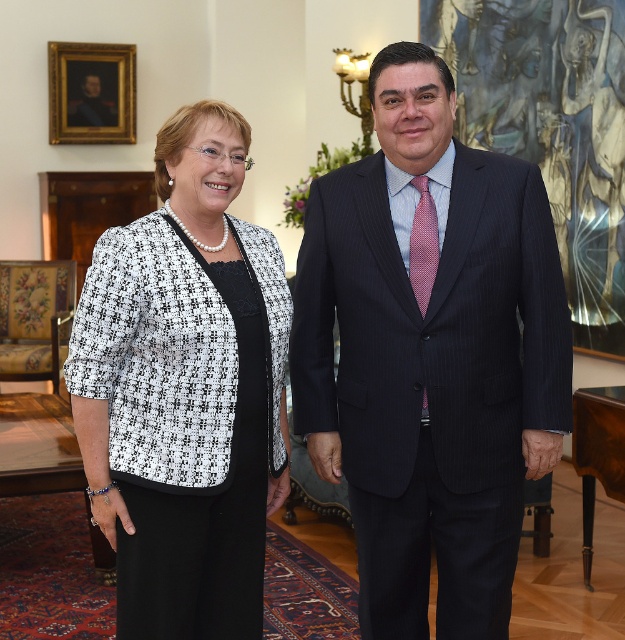
You are standing in the same room and want to place a small decorative item exactly at the position where the pinstriped wool suit at center is located. What are the coordinates of that position?

The coordinates of the position where the pinstriped wool suit at center is located are at point (x=432, y=381).

In the scene shown: You are an interior designer assessing the layout of this room. You notice the black tweed blazer at center and the goldwooden frame at upper left. Which object occupies a larger vertical space in the image?

The black tweed blazer at center is much taller than the goldwooden frame at upper left, so it occupies a larger vertical space in the image.